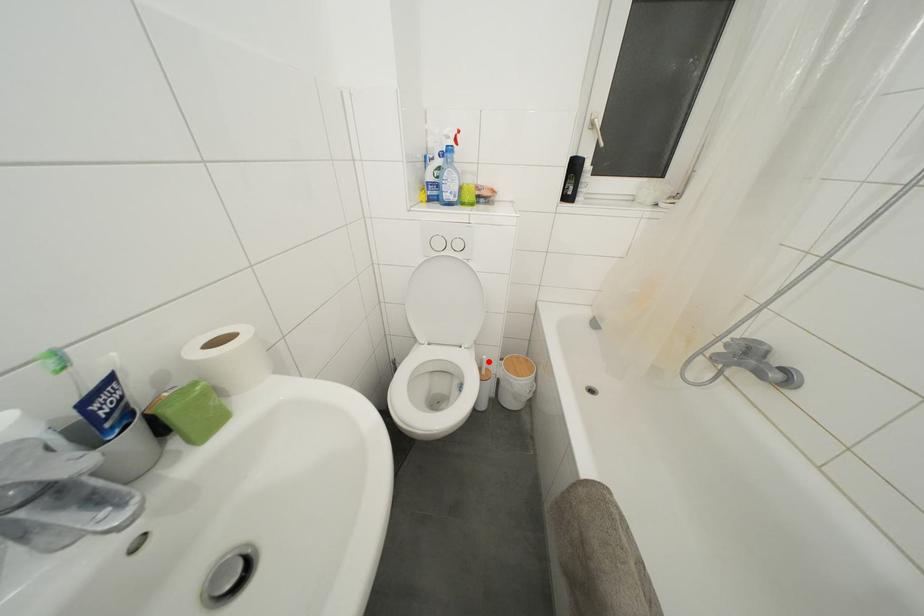
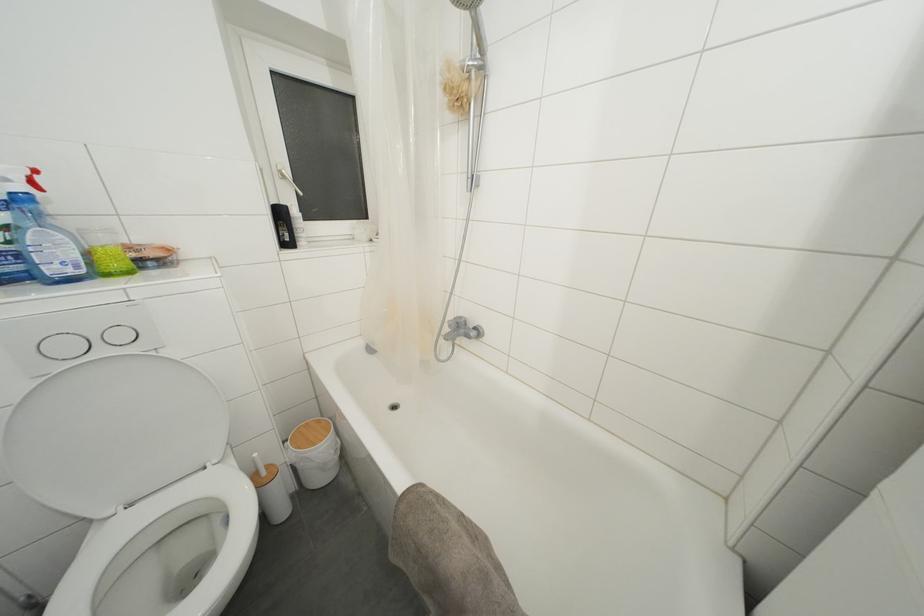
The point at the highlighted location is marked in the first image. Where is the corresponding point in the second image?

(260, 459)